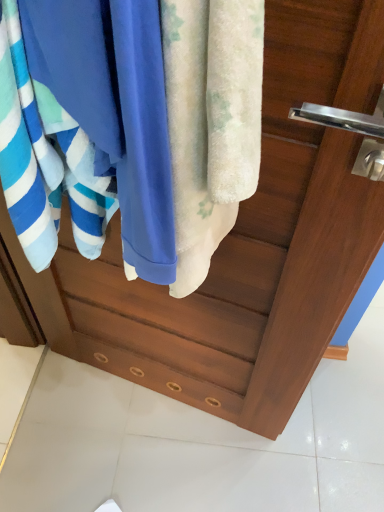
Question: From the image's perspective, relative to fluffy white towel at center, the first towel in the right-to-left sequence, is blue soft towel at left, which is the first towel from left to right, above or below?

Choices:
 (A) below
 (B) above

Answer: (B)

Question: Based on their positions, is blue soft towel at left, which is the first towel from left to right, located to the left or right of fluffy white towel at center, acting as the 2th towel starting from the left?

Choices:
 (A) right
 (B) left

Answer: (B)

Question: Which object is the farthest from the fluffy white towel at center, the first towel in the right-to-left sequence?

Choices:
 (A) blue soft towel at left, marked as the 2th towel in a right-to-left arrangement
 (B) blue cotton towel at center

Answer: (A)

Question: Estimate the real-world distances between objects in this image. Which object is farther from the blue soft towel at left, which is the first towel from left to right?

Choices:
 (A) fluffy white towel at center, the first towel in the right-to-left sequence
 (B) blue cotton towel at center

Answer: (A)